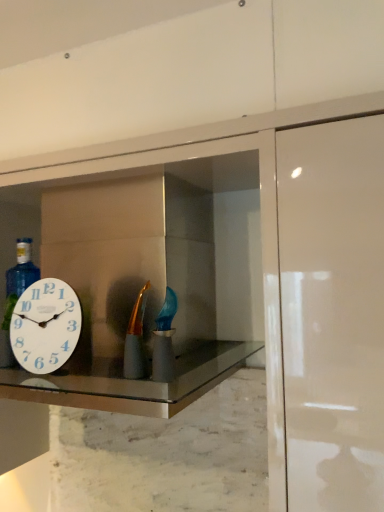
You are a GUI agent. You are given a task and a screenshot of the screen. Output one action in this format:
    pyautogui.click(x=<x>, y=<y>)
    Task: Click on the marble at center
    Image resolution: width=384 pixels, height=512 pixels.
    Given the screenshot: What is the action you would take?
    pyautogui.click(x=132, y=382)

This screenshot has height=512, width=384. Describe the element at coordinates (136, 339) in the screenshot. I see `matte gold bottle at center` at that location.

What are the coordinates of `white glossy medicine cabinet at center` in the screenshot? It's located at (155, 279).

Is matte gold bottle at center inside marble at center?

No, matte gold bottle at center is not a part of marble at center.

Is point (16, 388) closer to camera compared to point (142, 296)?

No, it is not.

Based on the photo, which object is positioned more to the right, marble at center or matte gold bottle at center?

matte gold bottle at center is more to the right.

Locate an element on the screen. wall clock behind the white glossy medicine cabinet at center is located at coordinates pyautogui.click(x=45, y=326).

Based on the photo, is white glossy medicine cabinet at center facing towards white glossy clock at left?

Yes, white glossy medicine cabinet at center is oriented towards white glossy clock at left.

Is white glossy medicine cabinet at center outside of white glossy clock at left?

Yes, white glossy medicine cabinet at center is not within white glossy clock at left.

Which is more to the left, white glossy medicine cabinet at center or white glossy clock at left?

Positioned to the left is white glossy clock at left.

Is the surface of marble at center in direct contact with white glossy clock at left?

No, marble at center is not making contact with white glossy clock at left.

Based on the photo, is marble at center not inside white glossy clock at left?

Yes, marble at center is located beyond the bounds of white glossy clock at left.

In the scene shown: Considering their positions, is marble at center located in front of or behind white glossy clock at left?

Clearly, marble at center is in front of white glossy clock at left.

Which object is positioned more to the right, marble at center or white glossy clock at left?

From the viewer's perspective, marble at center appears more on the right side.

Is white glossy medicine cabinet at center located outside marble at center?

Indeed, white glossy medicine cabinet at center is completely outside marble at center.

Considering the positions of point (231, 273) and point (231, 354), is point (231, 273) closer or farther from the camera than point (231, 354)?

Point (231, 273) is positioned farther from the camera compared to point (231, 354).

Can you tell me how much white glossy medicine cabinet at center and marble at center differ in facing direction?

The facing directions of white glossy medicine cabinet at center and marble at center are 0.454 degrees apart.

Who is more distant, white glossy medicine cabinet at center or marble at center?

white glossy medicine cabinet at center is further away from the camera.

Does point (111, 359) come behind point (96, 231)?

No, (111, 359) is closer to viewer.

Does marble at center have a lesser height compared to white glossy medicine cabinet at center?

Yes, marble at center is shorter than white glossy medicine cabinet at center.

Is marble at center facing away from white glossy medicine cabinet at center?

Yes, marble at center is positioned with its back facing white glossy medicine cabinet at center.

How many degrees apart are the facing directions of marble at center and white glossy medicine cabinet at center?

The facing directions of marble at center and white glossy medicine cabinet at center are 0.454 degrees apart.

Is white glossy medicine cabinet at center turned away from matte gold bottle at center?

Yes, matte gold bottle at center is at the back of white glossy medicine cabinet at center.

Which object is wider, white glossy medicine cabinet at center or matte gold bottle at center?

white glossy medicine cabinet at center.

Between white glossy medicine cabinet at center and matte gold bottle at center, which one appears on the left side from the viewer's perspective?

white glossy medicine cabinet at center is more to the left.

Considering their positions, is white glossy clock at left located in front of or behind matte gold bottle at center?

white glossy clock at left is behind matte gold bottle at center.

From the image's perspective, which one is positioned higher, white glossy clock at left or matte gold bottle at center?

matte gold bottle at center.

Could you tell me if white glossy clock at left is turned towards matte gold bottle at center?

No, white glossy clock at left is not aimed at matte gold bottle at center.

Measure the distance from white glossy clock at left to matte gold bottle at center.

white glossy clock at left and matte gold bottle at center are 15.30 centimeters apart from each other.

You are a GUI agent. You are given a task and a screenshot of the screen. Output one action in this format:
    pyautogui.click(x=<x>, y=<y>)
    Task: Click on the counter top below the matte gold bottle at center (from the image's perspective)
    The height and width of the screenshot is (512, 384).
    Given the screenshot: What is the action you would take?
    pyautogui.click(x=132, y=382)

Where is `wall clock above the white glossy medicine cabinet at center (from a real-world perspective)`? The height and width of the screenshot is (512, 384). wall clock above the white glossy medicine cabinet at center (from a real-world perspective) is located at coordinates (45, 326).

Based on their spatial positions, is marble at center or white glossy medicine cabinet at center closer to white glossy clock at left?

marble at center is closer to white glossy clock at left.

Estimate the real-world distances between objects in this image. Which object is closer to marble at center, matte gold bottle at center or white glossy clock at left?

white glossy clock at left is positioned closer to the anchor marble at center.

Based on their spatial positions, is matte gold bottle at center or white glossy medicine cabinet at center closer to marble at center?

matte gold bottle at center is closer to marble at center.

From the image, which object appears to be farther from matte gold bottle at center, white glossy medicine cabinet at center or marble at center?

Among the two, white glossy medicine cabinet at center is located further to matte gold bottle at center.

Considering their positions, is white glossy clock at left positioned closer to matte gold bottle at center than white glossy medicine cabinet at center?

white glossy clock at left is closer to matte gold bottle at center.

When comparing their distances from marble at center, does white glossy medicine cabinet at center or matte gold bottle at center seem closer?

matte gold bottle at center is closer to marble at center.

Looking at the image, which one is located further to matte gold bottle at center, marble at center or white glossy clock at left?

marble at center is positioned further to the anchor matte gold bottle at center.

Considering their positions, is matte gold bottle at center positioned closer to white glossy clock at left than marble at center?

The object closer to white glossy clock at left is marble at center.

The width and height of the screenshot is (384, 512). In order to click on counter top between white glossy clock at left and matte gold bottle at center in the horizontal direction in this screenshot , I will do `click(132, 382)`.

This screenshot has width=384, height=512. Identify the location of medicine cabinet between white glossy clock at left and marble at center from top to bottom. (155, 279).

I want to click on medicine cabinet between white glossy clock at left and matte gold bottle at center from left to right, so click(x=155, y=279).

Identify the location of counter top located between white glossy medicine cabinet at center and matte gold bottle at center in the left-right direction. The image size is (384, 512). (132, 382).